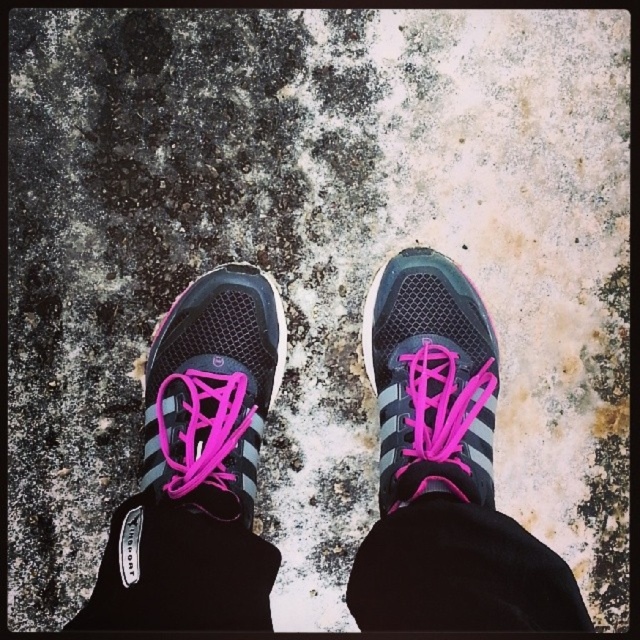
Is point (211, 621) farther from camera compared to point (436, 288)?

No.

Can you confirm if matte black sneakers at center is shorter than matte black sneaker at center?

No.

Does point (499, 595) lie in front of point (492, 401)?

Yes, it is in front of point (492, 401).

Find the location of `matte black sneakers at center`. matte black sneakers at center is located at coordinates (444, 470).

Between point (516, 563) and point (195, 339), which one is positioned in front?

Positioned in front is point (516, 563).

Between matte black sneakers at center and matte black shoe at center, which one has more height?

Standing taller between the two is matte black sneakers at center.

I want to click on matte black sneakers at center, so click(x=444, y=470).

Locate an element on the screen. This screenshot has height=640, width=640. matte black sneakers at center is located at coordinates (444, 470).

Which of these two, matte black sneaker at center or matte black shoe at center, stands taller?

Standing taller between the two is matte black sneaker at center.

Can you confirm if matte black sneaker at center is bigger than matte black shoe at center?

Yes.

The image size is (640, 640). What do you see at coordinates (429, 380) in the screenshot?
I see `matte black sneaker at center` at bounding box center [429, 380].

Identify the location of matte black sneaker at center. This screenshot has height=640, width=640. (429, 380).